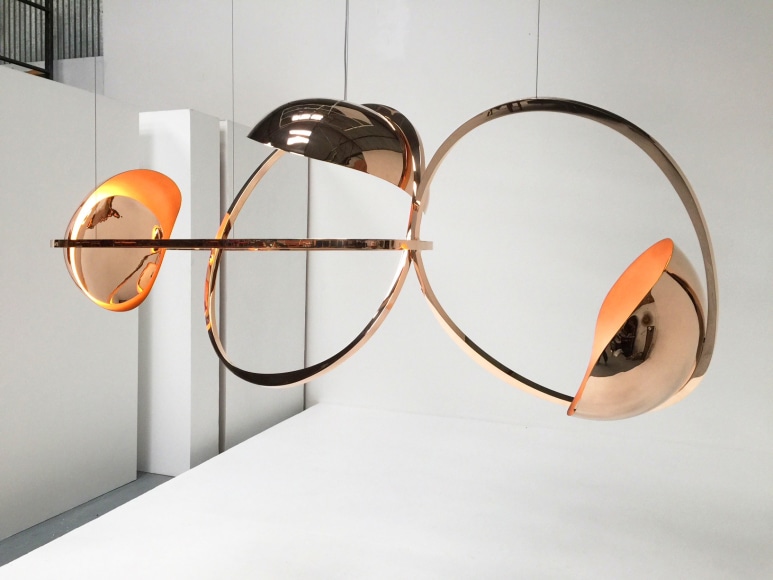
You are a GUI agent. You are given a task and a screenshot of the screen. Output one action in this format:
    pyautogui.click(x=<x>, y=<y>)
    Task: Click on the art
    
    Given the screenshot: What is the action you would take?
    pyautogui.click(x=450, y=139)